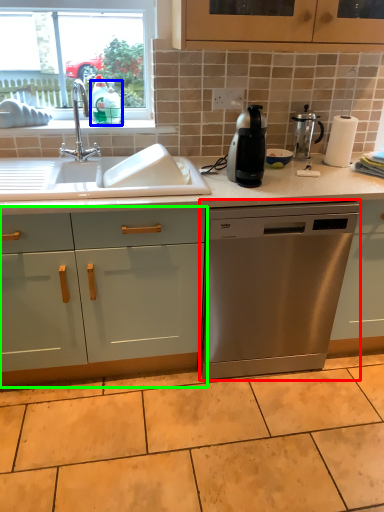
Question: Which object is the closest to the dishwasher (highlighted by a red box)? Choose among these: teal (highlighted by a blue box) or cabinetry (highlighted by a green box).

Choices:
 (A) teal
 (B) cabinetry

Answer: (B)